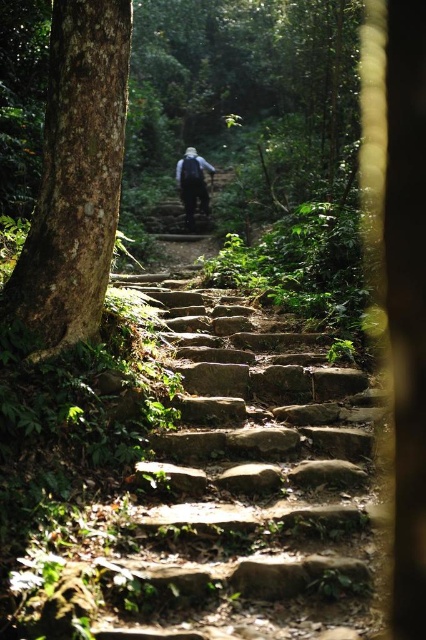
You are a hiker who wants to take a photo of the smooth brown tree trunk at left and the dark blue fabric backpack at center. Which object should you focus on first if you want to capture both in the same frame without moving the camera?

The smooth brown tree trunk at left is taller than the dark blue fabric backpack at center, so you should focus on the smooth brown tree trunk at left first to ensure it fits within the frame.